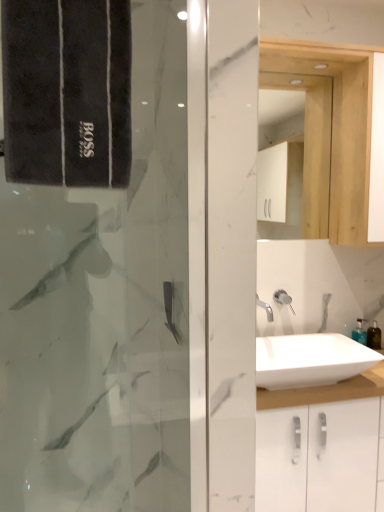
Question: Is translucent plastic soap dispenser at lower right closer to camera compared to white wood medicine cabinet at upper right?

Choices:
 (A) no
 (B) yes

Answer: (A)

Question: Considering the relative sizes of translucent plastic soap dispenser at lower right and white wood medicine cabinet at upper right in the image provided, is translucent plastic soap dispenser at lower right smaller than white wood medicine cabinet at upper right?

Choices:
 (A) no
 (B) yes

Answer: (B)

Question: From a real-world perspective, is translucent plastic soap dispenser at lower right located higher than white wood medicine cabinet at upper right?

Choices:
 (A) no
 (B) yes

Answer: (A)

Question: Can you confirm if translucent plastic soap dispenser at lower right is wider than white wood medicine cabinet at upper right?

Choices:
 (A) yes
 (B) no

Answer: (A)

Question: From a real-world perspective, is translucent plastic soap dispenser at lower right located beneath white wood medicine cabinet at upper right?

Choices:
 (A) no
 (B) yes

Answer: (B)

Question: Considering the positions of white glossy sink at center and black velvet towel at left in the image, is white glossy sink at center wider or thinner than black velvet towel at left?

Choices:
 (A) thin
 (B) wide

Answer: (B)

Question: Considering the positions of point (258, 358) and point (115, 74), is point (258, 358) closer or farther from the camera than point (115, 74)?

Choices:
 (A) closer
 (B) farther

Answer: (B)

Question: Which is correct: white glossy sink at center is inside black velvet towel at left, or outside of it?

Choices:
 (A) outside
 (B) inside

Answer: (A)

Question: From a real-world perspective, is white glossy sink at center above or below black velvet towel at left?

Choices:
 (A) above
 (B) below

Answer: (B)

Question: Considering the positions of black velvet towel at left and white glossy shower at center in the image, is black velvet towel at left wider or thinner than white glossy shower at center?

Choices:
 (A) thin
 (B) wide

Answer: (B)

Question: Relative to white glossy shower at center, is black velvet towel at left in front or behind?

Choices:
 (A) behind
 (B) front

Answer: (B)

Question: Is black velvet towel at left inside the boundaries of white glossy shower at center, or outside?

Choices:
 (A) outside
 (B) inside

Answer: (A)

Question: From the image's perspective, is black velvet towel at left above or below white glossy shower at center?

Choices:
 (A) below
 (B) above

Answer: (B)

Question: Visually, is white wood medicine cabinet at upper right positioned to the left or to the right of white glossy shower at center?

Choices:
 (A) left
 (B) right

Answer: (B)

Question: Is white wood medicine cabinet at upper right taller or shorter than white glossy shower at center?

Choices:
 (A) short
 (B) tall

Answer: (B)